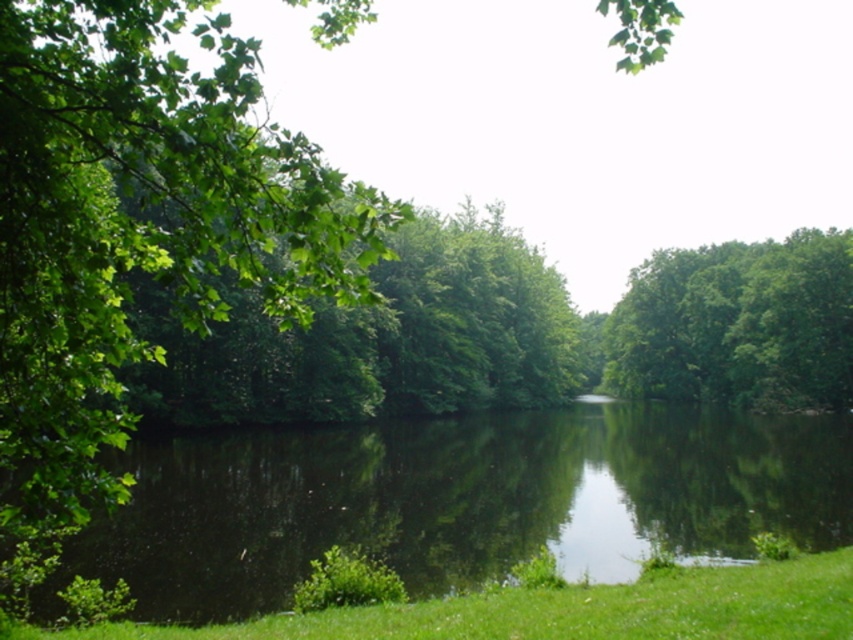
Question: Which of the following is the farthest from the observer?

Choices:
 (A) (138, 596)
 (B) (688, 621)

Answer: (A)

Question: Is green reflective water at center above green grass at lower center?

Choices:
 (A) no
 (B) yes

Answer: (A)

Question: Which point is closer to the camera?

Choices:
 (A) green reflective water at center
 (B) green grass at lower center

Answer: (B)

Question: Is green reflective water at center closer to camera compared to green grass at lower center?

Choices:
 (A) yes
 (B) no

Answer: (B)

Question: Which object appears farthest from the camera in this image?

Choices:
 (A) green grass at lower center
 (B) green reflective water at center

Answer: (B)

Question: In this image, where is green reflective water at center located relative to green grass at lower center?

Choices:
 (A) below
 (B) above

Answer: (A)